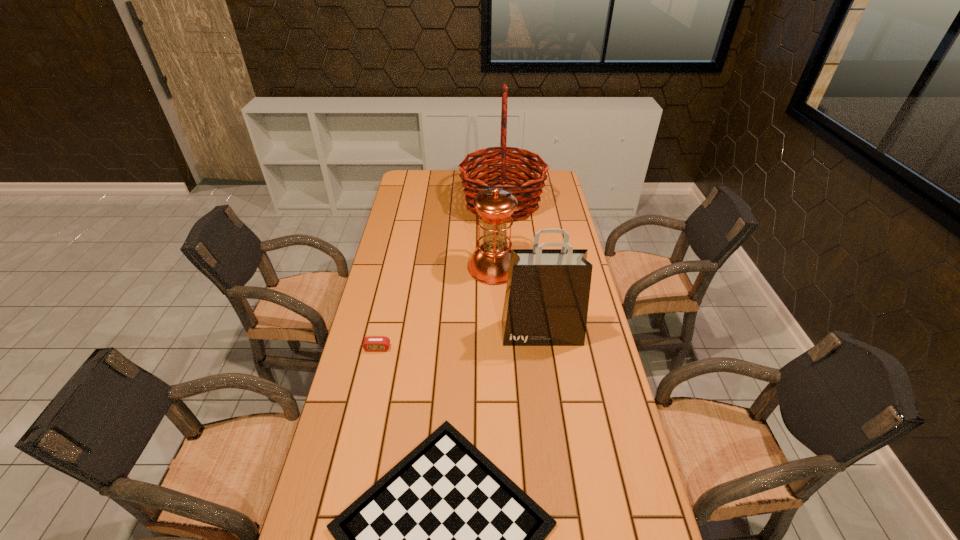
Where is `the farthest object`? the farthest object is located at coordinates (527, 193).

You are a GUI agent. You are given a task and a screenshot of the screen. Output one action in this format:
    pyautogui.click(x=<x>, y=<y>)
    Task: Click on the tallest object
    This screenshot has width=960, height=540.
    Given the screenshot: What is the action you would take?
    [x=527, y=193]

Identify the location of shopping bag. pos(546,302).

The image size is (960, 540). I want to click on oil lamp, so click(x=489, y=263).

At what (x,y) coordinates should I click in order to perform the action: click on the fourth tallest object. Please return your answer as a coordinate pair (x, y). The width and height of the screenshot is (960, 540). Looking at the image, I should click on (371, 343).

Identify the location of free region located 0.110m on the back of the tallest object. This screenshot has height=540, width=960. (500, 172).

What are the coordinates of `free point located on the front with handles of the shopping bag` in the screenshot? It's located at (552, 403).

The image size is (960, 540). Find the location of `free space located on the back of the oil lamp`. free space located on the back of the oil lamp is located at coordinates (492, 240).

The image size is (960, 540). I want to click on vacant region located on the front-facing side of the fourth tallest object, so click(x=372, y=373).

In order to click on object situated at the far edge in this screenshot , I will do `click(527, 193)`.